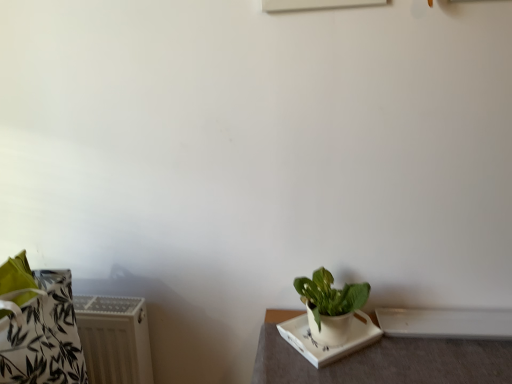
What are the coordinates of `vacant space situated above white textured radiator at lower left (from a real-world perspective)` in the screenshot? It's located at point(102,305).